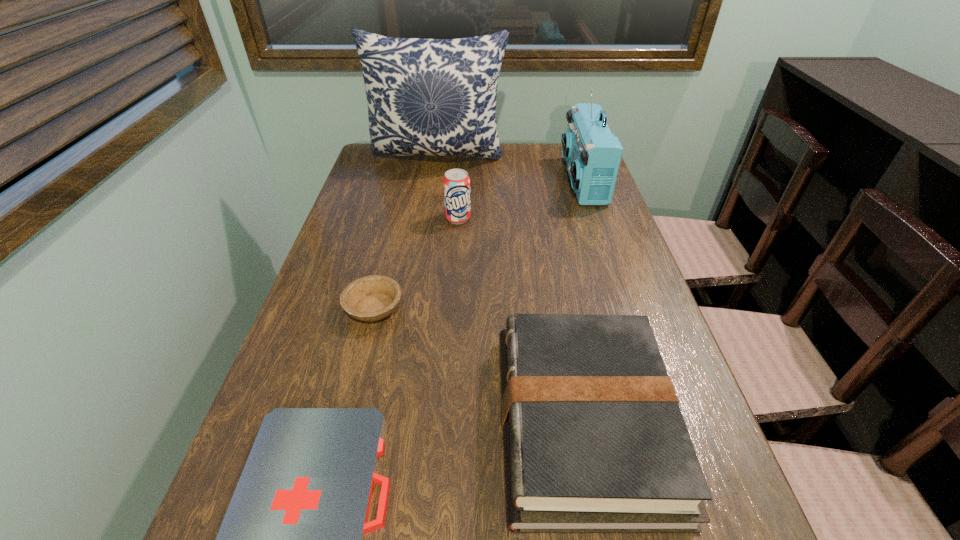
Where is `empty space between the cushion and the fourth farthest object`? Image resolution: width=960 pixels, height=540 pixels. empty space between the cushion and the fourth farthest object is located at coordinates (406, 233).

At what (x,y) coordinates should I click in order to perform the action: click on blank region between the cushion and the fourth tallest object. Please return your answer as a coordinate pair (x, y). This screenshot has height=540, width=960. Looking at the image, I should click on (511, 290).

Identify the location of object that is the closest one to the hardback book. The height and width of the screenshot is (540, 960). (292, 539).

The height and width of the screenshot is (540, 960). In order to click on the closest object to the cushion in this screenshot , I will do `click(592, 153)`.

In order to click on free space that satisfies the following two spatial constraints: 1. on the front-facing side of the radio receiver; 2. on the front side of the bowl in this screenshot , I will do `click(626, 308)`.

The width and height of the screenshot is (960, 540). Identify the location of blank space that satisfies the following two spatial constraints: 1. on the front-facing side of the radio receiver; 2. on the front side of the soda can. (595, 218).

This screenshot has height=540, width=960. Identify the location of free location that satisfies the following two spatial constraints: 1. on the front-facing side of the fifth shortest object; 2. on the front side of the bowl. (626, 308).

Where is `free region that satisfies the following two spatial constraints: 1. on the back side of the third farthest object; 2. on the left side of the fourth farthest object`? The height and width of the screenshot is (540, 960). free region that satisfies the following two spatial constraints: 1. on the back side of the third farthest object; 2. on the left side of the fourth farthest object is located at coordinates (396, 218).